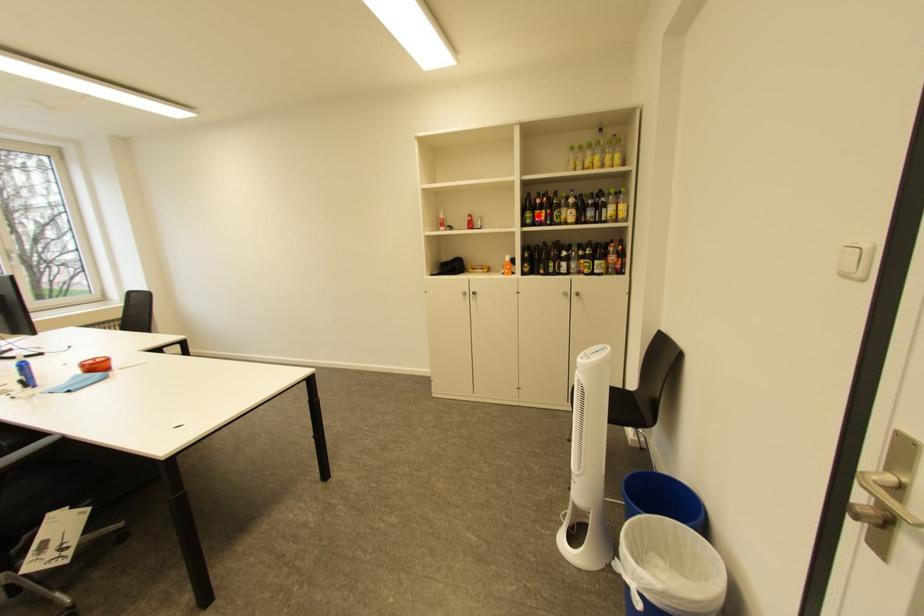
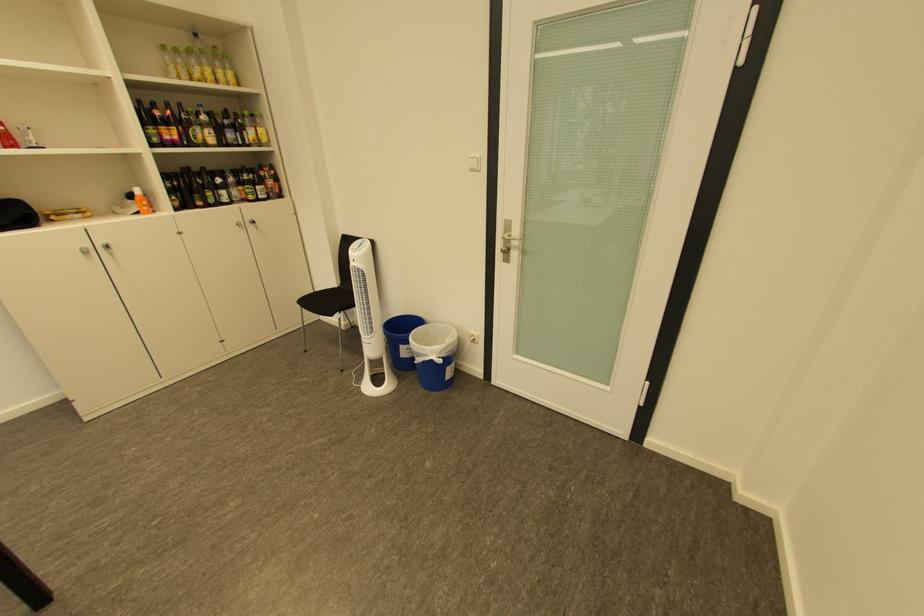
Locate, in the second image, the point that corresponds to the highlighted location in the first image.

(162, 132)